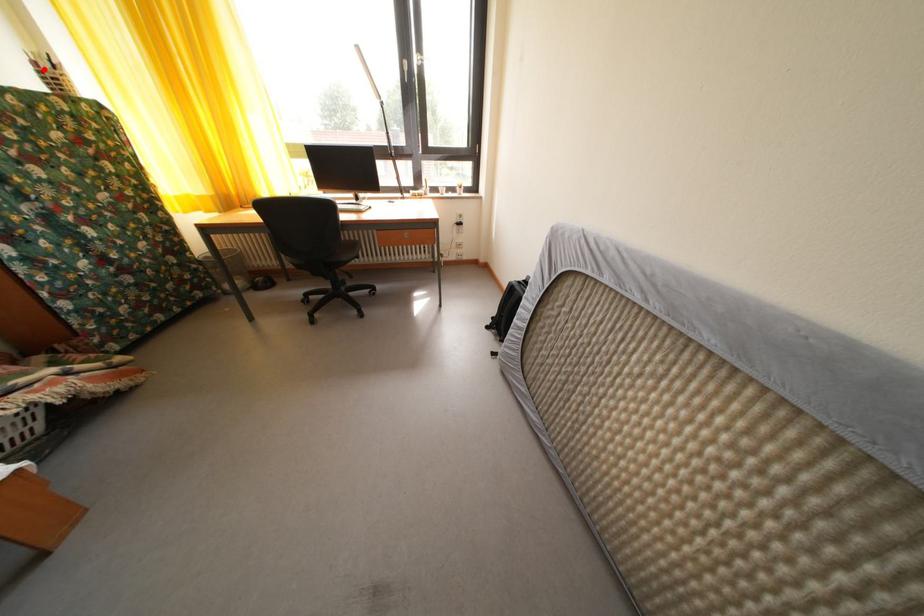
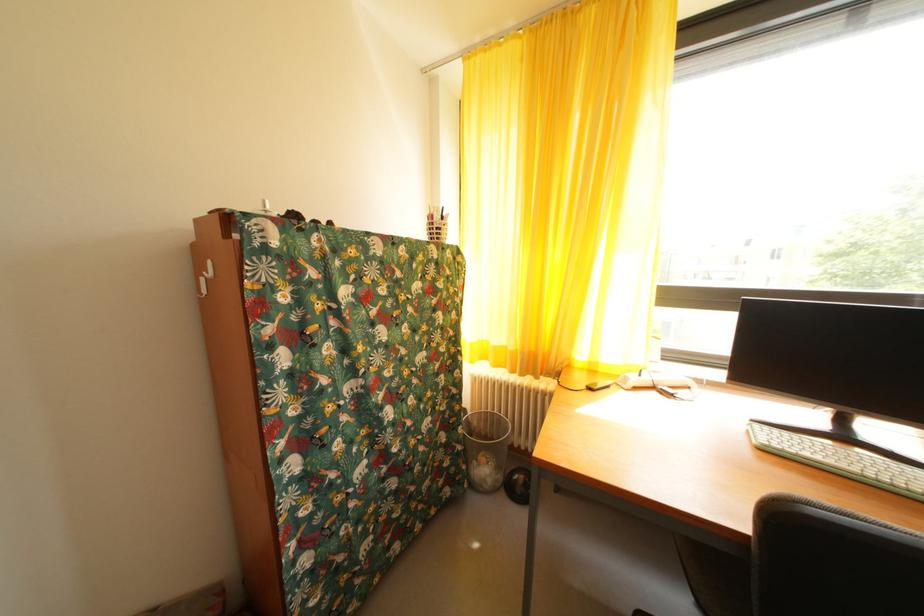
The point at the highlighted location is marked in the first image. Where is the corresponding point in the second image?

(440, 223)